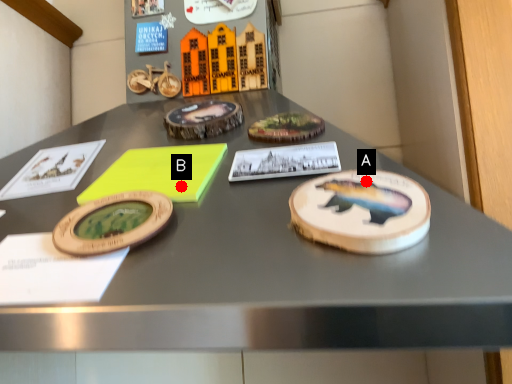
Question: Two points are circled on the image, labeled by A and B beside each circle. Which point is farther from the camera taking this photo?

Choices:
 (A) A is further
 (B) B is further

Answer: (B)